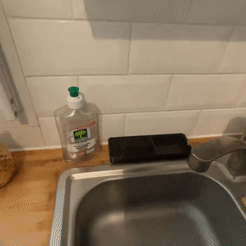
Identify the location of red/white label on detergent bottle. (84, 135).